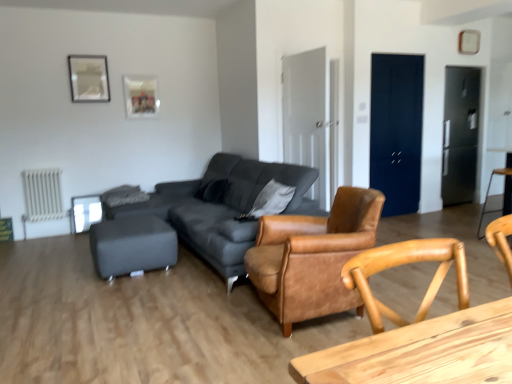
Question: Can you confirm if matte glass picture frame at upper center, the first picture frame viewed from the right, is taller than white metallic radiator at lower left?

Choices:
 (A) yes
 (B) no

Answer: (B)

Question: Is matte glass picture frame at upper center, marked as the 2th picture frame in a front-to-back arrangement, next to white metallic radiator at lower left and touching it?

Choices:
 (A) yes
 (B) no

Answer: (B)

Question: Is the position of matte glass picture frame at upper center, the 2th picture frame viewed from the left, more distant than that of white metallic radiator at lower left?

Choices:
 (A) yes
 (B) no

Answer: (A)

Question: Is matte glass picture frame at upper center, the first picture frame viewed from the right, facing away from white metallic radiator at lower left?

Choices:
 (A) no
 (B) yes

Answer: (A)

Question: Is matte glass picture frame at upper center, the 2th picture frame viewed from the left, outside of white metallic radiator at lower left?

Choices:
 (A) yes
 (B) no

Answer: (A)

Question: Does matte glass picture frame at upper center, marked as the 2th picture frame in a front-to-back arrangement, have a lesser height compared to wooden bar stool at right, marked as the first bar stool in a right-to-left arrangement?

Choices:
 (A) no
 (B) yes

Answer: (B)

Question: Can you confirm if matte glass picture frame at upper center, the first picture frame viewed from the right, is smaller than wooden bar stool at right, marked as the first bar stool in a right-to-left arrangement?

Choices:
 (A) yes
 (B) no

Answer: (A)

Question: Considering the relative positions of matte glass picture frame at upper center, the first picture frame viewed from the right, and wooden bar stool at right, marked as the first bar stool in a right-to-left arrangement, in the image provided, is matte glass picture frame at upper center, the first picture frame viewed from the right, to the left of wooden bar stool at right, marked as the first bar stool in a right-to-left arrangement, from the viewer's perspective?

Choices:
 (A) no
 (B) yes

Answer: (B)

Question: From the image's perspective, is matte glass picture frame at upper center, which is the 1th picture frame in back-to-front order, beneath wooden bar stool at right, marked as the 2th bar stool in a left-to-right arrangement?

Choices:
 (A) no
 (B) yes

Answer: (A)

Question: Is wooden bar stool at right, marked as the 2th bar stool in a left-to-right arrangement, at the back of matte glass picture frame at upper center, marked as the 2th picture frame in a front-to-back arrangement?

Choices:
 (A) yes
 (B) no

Answer: (B)

Question: Can you confirm if matte glass picture frame at upper center, marked as the 2th picture frame in a front-to-back arrangement, is positioned to the right of wooden bar stool at right, marked as the first bar stool in a right-to-left arrangement?

Choices:
 (A) yes
 (B) no

Answer: (B)

Question: From the image's perspective, is white metallic radiator at lower left located beneath matte gray ottoman at lower left, the first bar stool when ordered from left to right?

Choices:
 (A) yes
 (B) no

Answer: (B)